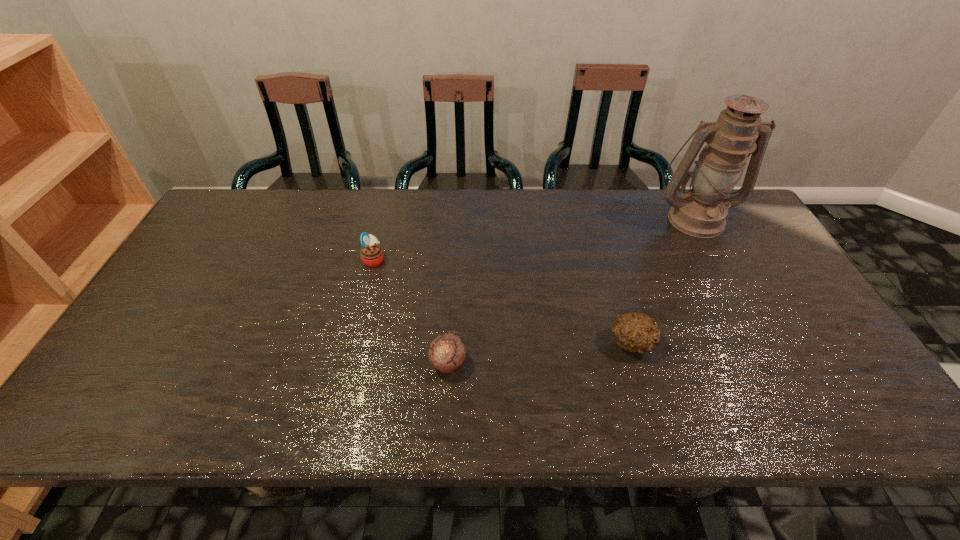
I want to click on muffin that stands as the closest to the third object from left to right, so click(x=447, y=352).

Locate an element on the screen. The width and height of the screenshot is (960, 540). vacant region that satisfies the following two spatial constraints: 1. on the front-facing side of the second object from right to left; 2. on the left side of the third nearest object is located at coordinates (353, 343).

Locate an element on the screen. This screenshot has height=540, width=960. free space that satisfies the following two spatial constraints: 1. on the front-facing side of the leftmost muffin; 2. on the left side of the rightmost muffin is located at coordinates (353, 343).

Find the location of a particular element. free location that satisfies the following two spatial constraints: 1. on the front-facing side of the third object from left to right; 2. on the left side of the second tallest object is located at coordinates (353, 343).

Where is `vacant space that satisfies the following two spatial constraints: 1. on the front-facing side of the leftmost object; 2. on the right side of the rightmost muffin`? Image resolution: width=960 pixels, height=540 pixels. vacant space that satisfies the following two spatial constraints: 1. on the front-facing side of the leftmost object; 2. on the right side of the rightmost muffin is located at coordinates (353, 343).

Identify the location of free location that satisfies the following two spatial constraints: 1. on the front-facing side of the farthest muffin; 2. on the left side of the rightmost muffin. The height and width of the screenshot is (540, 960). (353, 343).

Identify the location of free space that satisfies the following two spatial constraints: 1. on the front-facing side of the leftmost object; 2. on the left side of the rightmost muffin. The width and height of the screenshot is (960, 540). (353, 343).

In order to click on blank area in the image that satisfies the following two spatial constraints: 1. on the front side of the rightmost object; 2. on the front-facing side of the leftmost muffin in this screenshot , I will do `click(717, 259)`.